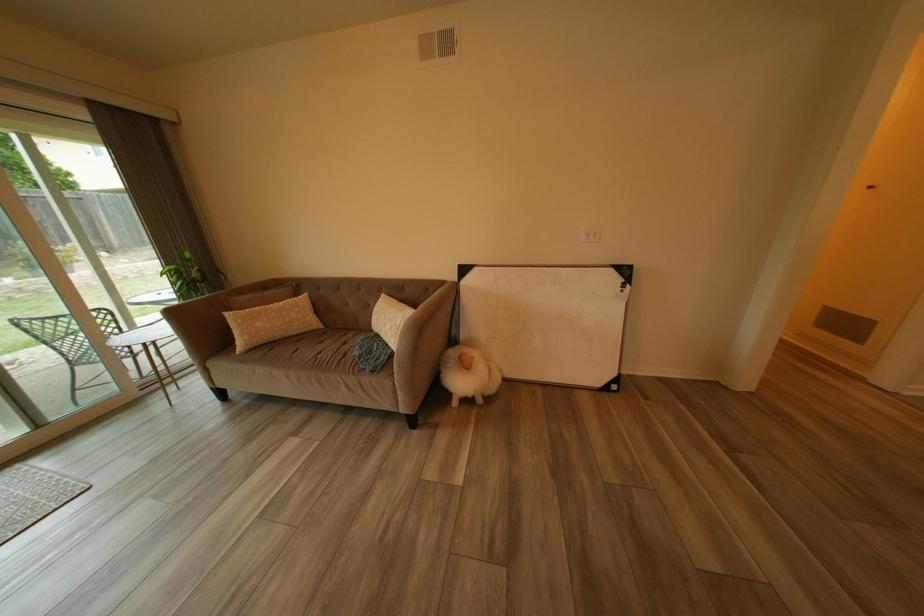
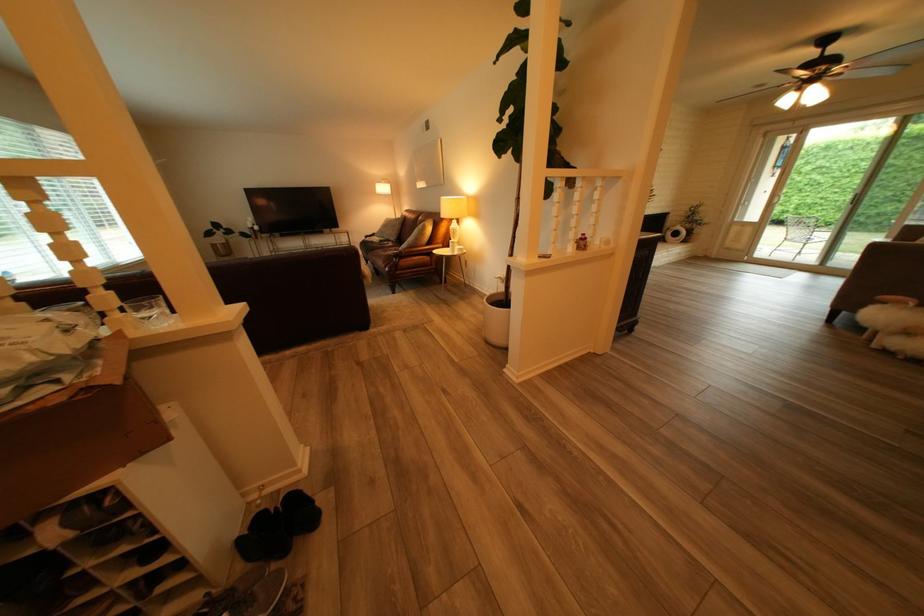
Locate, in the second image, the point that corresponds to (493,402) in the first image.

(890, 346)